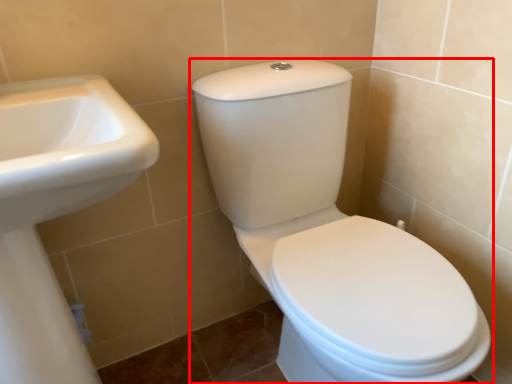
Question: From the image's perspective, considering the relative positions of toilet (annotated by the red box) and sink in the image provided, where is toilet (annotated by the red box) located with respect to the staircase?

Choices:
 (A) above
 (B) below

Answer: (A)